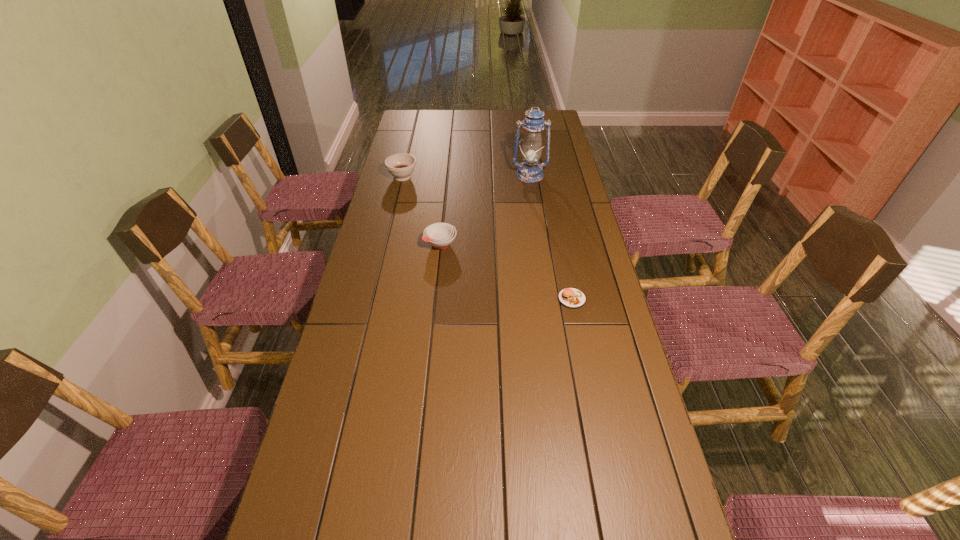
Locate an element on the screen. This screenshot has width=960, height=540. the tallest object is located at coordinates (530, 171).

Locate an element on the screen. This screenshot has width=960, height=540. the third shortest object is located at coordinates (401, 166).

I want to click on the taller soup bowl, so click(x=401, y=166).

Identify the location of the nearer soup bowl. (440, 235).

This screenshot has height=540, width=960. I want to click on the third object from right to left, so click(440, 235).

The image size is (960, 540). Find the location of `patty`. patty is located at coordinates (573, 298).

Find the location of a particular element. the shortest object is located at coordinates (573, 298).

Where is `vacant space located on the front-facing side of the lantern`? Image resolution: width=960 pixels, height=540 pixels. vacant space located on the front-facing side of the lantern is located at coordinates (540, 237).

Identify the location of vacant region located 0.320m on the right of the farther soup bowl. This screenshot has height=540, width=960. (490, 177).

Where is `vacant area located on the right of the shorter soup bowl`? vacant area located on the right of the shorter soup bowl is located at coordinates (535, 244).